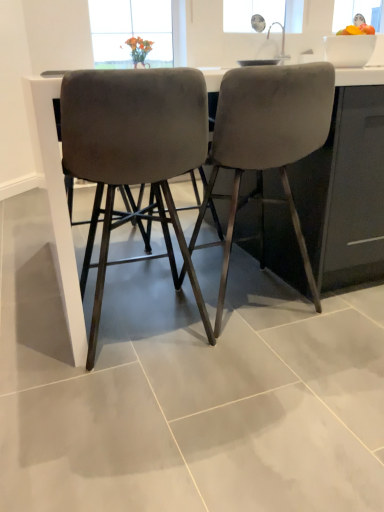
Question: From a real-world perspective, is velvet grey chair at center, marked as the 2th chair in a right-to-left arrangement, positioned under velvet gray chair at center, which is the 1th chair in right-to-left order, based on gravity?

Choices:
 (A) yes
 (B) no

Answer: (A)

Question: Is velvet grey chair at center, marked as the 2th chair in a right-to-left arrangement, thinner than velvet gray chair at center, which is the 1th chair in right-to-left order?

Choices:
 (A) yes
 (B) no

Answer: (A)

Question: Is velvet grey chair at center, marked as the 2th chair in a right-to-left arrangement, positioned with its back to velvet gray chair at center, which is the 2th chair from left to right?

Choices:
 (A) no
 (B) yes

Answer: (A)

Question: From the image's perspective, is velvet grey chair at center, the first chair viewed from the left, above velvet gray chair at center, which is the 2th chair from left to right?

Choices:
 (A) no
 (B) yes

Answer: (A)

Question: Is velvet grey chair at center, the first chair viewed from the left, shorter than velvet gray chair at center, which is the 1th chair in right-to-left order?

Choices:
 (A) no
 (B) yes

Answer: (B)

Question: Considering the positions of velvet gray chair at center, which is the 2th chair from left to right, and velvet grey chair at center, marked as the 2th chair in a right-to-left arrangement, in the image, is velvet gray chair at center, which is the 2th chair from left to right, wider or thinner than velvet grey chair at center, marked as the 2th chair in a right-to-left arrangement,?

Choices:
 (A) wide
 (B) thin

Answer: (A)

Question: From the image's perspective, is velvet gray chair at center, which is the 2th chair from left to right, positioned above or below velvet grey chair at center, the first chair viewed from the left?

Choices:
 (A) above
 (B) below

Answer: (A)

Question: In terms of size, does velvet gray chair at center, which is the 2th chair from left to right, appear bigger or smaller than velvet grey chair at center, the first chair viewed from the left?

Choices:
 (A) big
 (B) small

Answer: (A)

Question: Which is correct: velvet gray chair at center, which is the 1th chair in right-to-left order, is inside velvet grey chair at center, the first chair viewed from the left, or outside of it?

Choices:
 (A) outside
 (B) inside

Answer: (A)

Question: From a real-world perspective, is satin gray barstools at center positioned above or below velvet gray chair at center, which is the 2th chair from left to right?

Choices:
 (A) below
 (B) above

Answer: (A)

Question: Would you say satin gray barstools at center is to the left or to the right of velvet gray chair at center, which is the 1th chair in right-to-left order, in the picture?

Choices:
 (A) right
 (B) left

Answer: (A)

Question: In terms of height, does satin gray barstools at center look taller or shorter compared to velvet gray chair at center, which is the 1th chair in right-to-left order?

Choices:
 (A) tall
 (B) short

Answer: (B)

Question: Is point (54, 250) closer or farther from the camera than point (324, 71)?

Choices:
 (A) closer
 (B) farther

Answer: (B)

Question: From the image's perspective, is velvet grey chair at center, the first chair viewed from the left, located above or below satin gray barstools at center?

Choices:
 (A) above
 (B) below

Answer: (B)

Question: In terms of height, does velvet grey chair at center, marked as the 2th chair in a right-to-left arrangement, look taller or shorter compared to satin gray barstools at center?

Choices:
 (A) tall
 (B) short

Answer: (B)